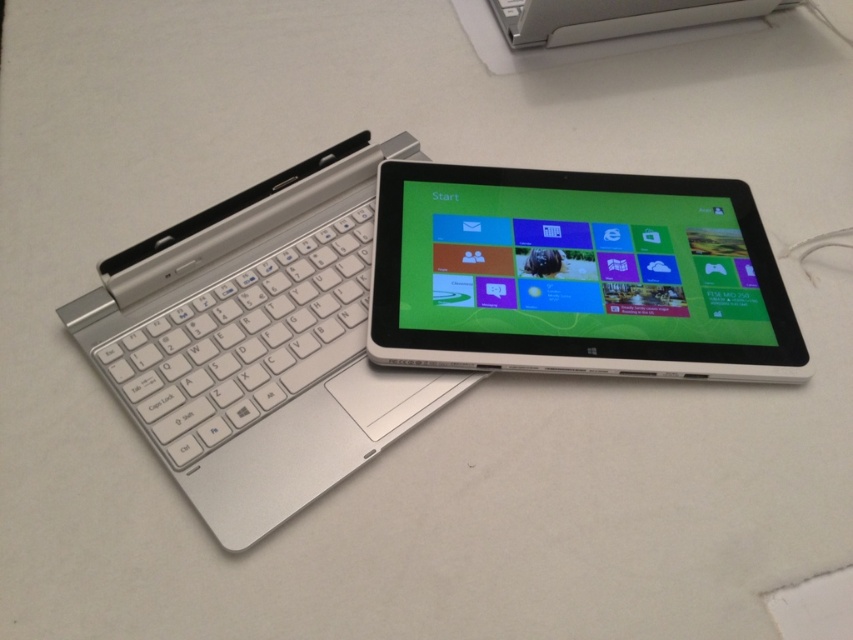
You are setting up a workspace and need to place a laptop bag between the silver metallic laptop at upper left and the silver metallic keyboard at left. Based on their positions, which object should the bag be closer to?

The silver metallic laptop at upper left is in front of the silver metallic keyboard at left, so the bag should be placed closer to the silver metallic keyboard at left to maintain proper spacing between the two devices.

Please describe the position of the silver metallic laptop at upper left in terms of coordinates within the image frame. The image frame has a coordinate system where the origin is at the bottom left corner, with x increasing to the right and y increasing upward. The coordinates are normalized between 0 and 1. You must use the exact object label provided in the question.

The silver metallic laptop at upper left is located at coordinates approximately 0.536 along the x axis and 0.304 along the y axis within the image frame.

You are setting up a portable workspace and need to choose between the silver metallic laptop at upper left and the white plastic tablet at center. Based on their thickness, which one is easier to carry in a slim bag?

The silver metallic laptop at upper left is thinner than the white plastic tablet at center, so it would be easier to carry in a slim bag.